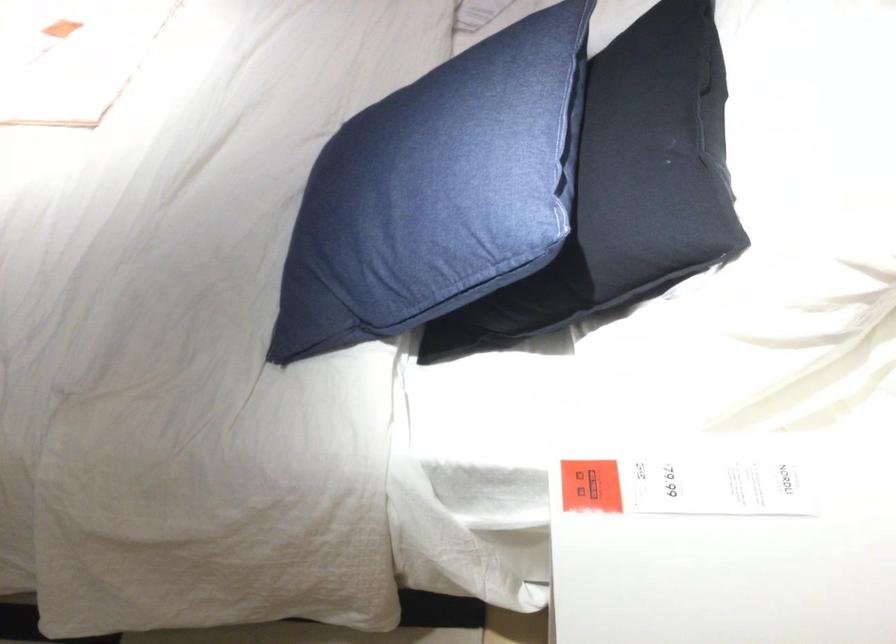
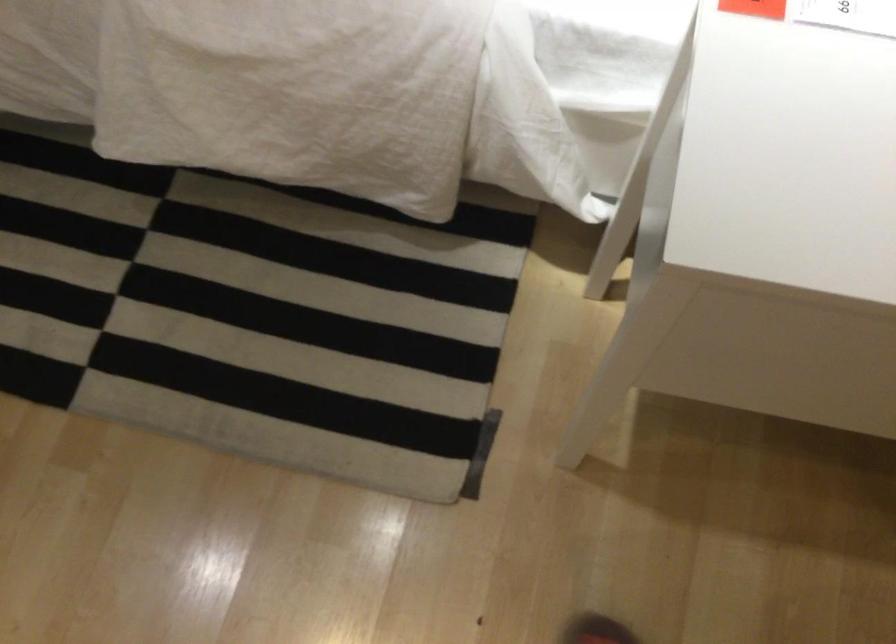
In the second image, find the point that corresponds to (597,503) in the first image.

(754, 8)